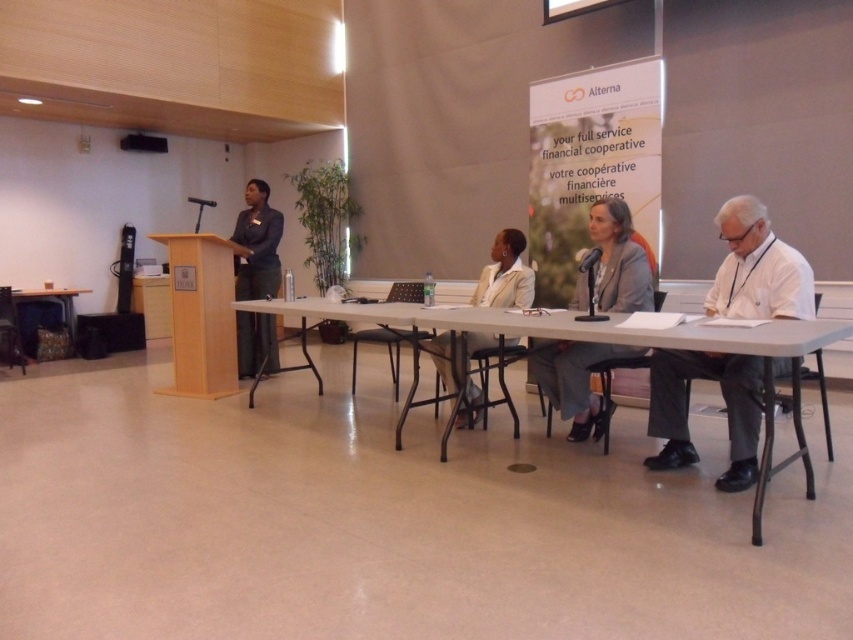
Question: Is white plastic table at center bigger than dark blue fabric jacket at left?

Choices:
 (A) yes
 (B) no

Answer: (A)

Question: Is the position of white plastic table at center more distant than that of wooden table at lower left?

Choices:
 (A) no
 (B) yes

Answer: (A)

Question: Which point is closer to the camera?

Choices:
 (A) (717, 220)
 (B) (496, 305)
 (C) (270, 282)

Answer: (A)

Question: Among these objects, which one is farthest from the camera?

Choices:
 (A) dark blue fabric jacket at left
 (B) light beige fabric jacket at center
 (C) white paper at right

Answer: (A)

Question: Which point is closer to the camera?

Choices:
 (A) (664, 316)
 (B) (70, 307)
 (C) (256, 292)
 (D) (596, 275)

Answer: (A)

Question: Is dark blue fabric jacket at left to the right of light beige fabric jacket at center from the viewer's perspective?

Choices:
 (A) yes
 (B) no

Answer: (B)